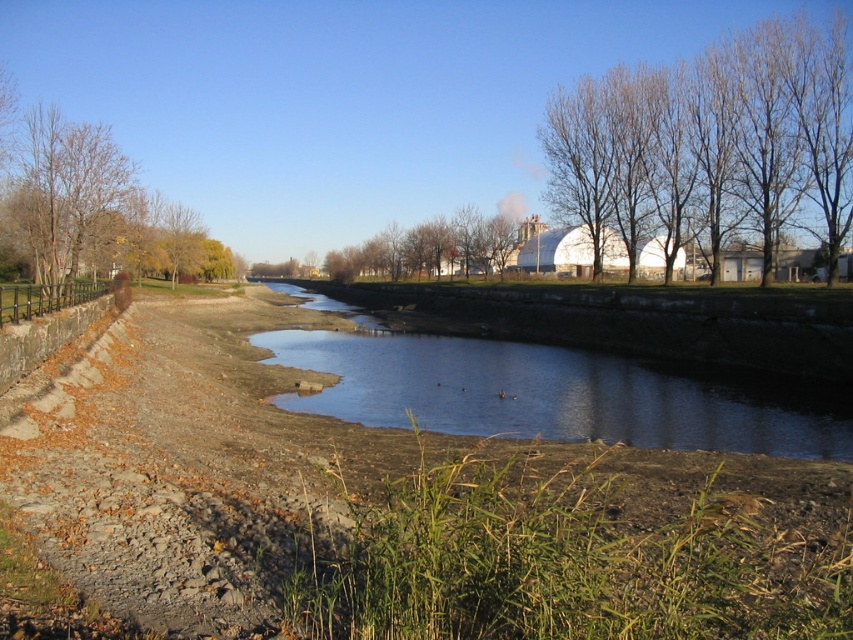
You are standing at the riverside and want to take a photo of both the bare branches at upper right and the brown leafy tree at center. Which object should you adjust your camera to focus on first if you want to capture both in the frame without moving your position?

You should focus on the brown leafy tree at center first because the bare branches at upper right is to the right of it, so adjusting the camera to include both would require framing from the center towards the right.

You are standing at the point closer to the camera in the image. Which point are you at, point [567,348] or point [96,168]?

You are at point [567,348] because it is closer to the camera than point [96,168].